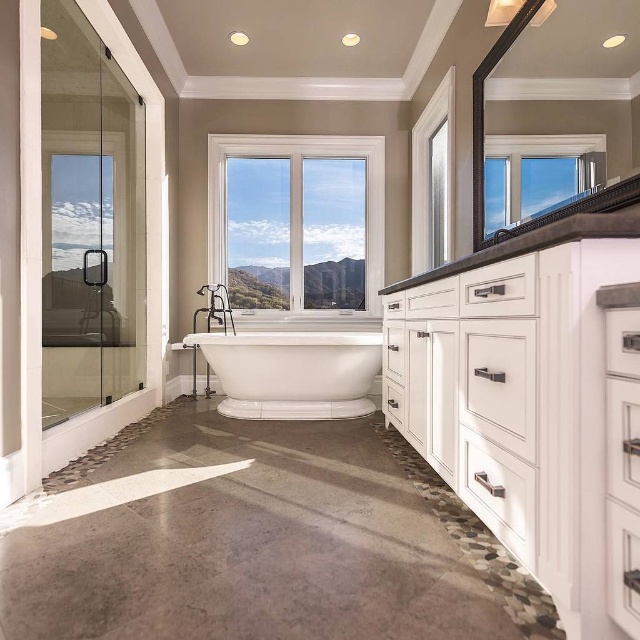
You are a home inspector assessing the bathroom layout. You need to determine if the white matte cabinet at right can be accessed without stepping into the white glossy bathtub at center. Based on their positions, can you reach the cabinet while staying on the bathroom floor?

The white matte cabinet at right is above the white glossy bathtub at center, so you can access it without stepping into the bathtub as it is positioned higher and reachable from the floor.

You are standing in the bathroom and want to look outside through the clear glass window at center. Can you see the white glossy bathtub at center blocking your view? Please explain.

The clear glass window at center is further to the viewer than the white glossy bathtub at center, so the bathtub is closer to you. This means the white glossy bathtub at center would block your view of the window.